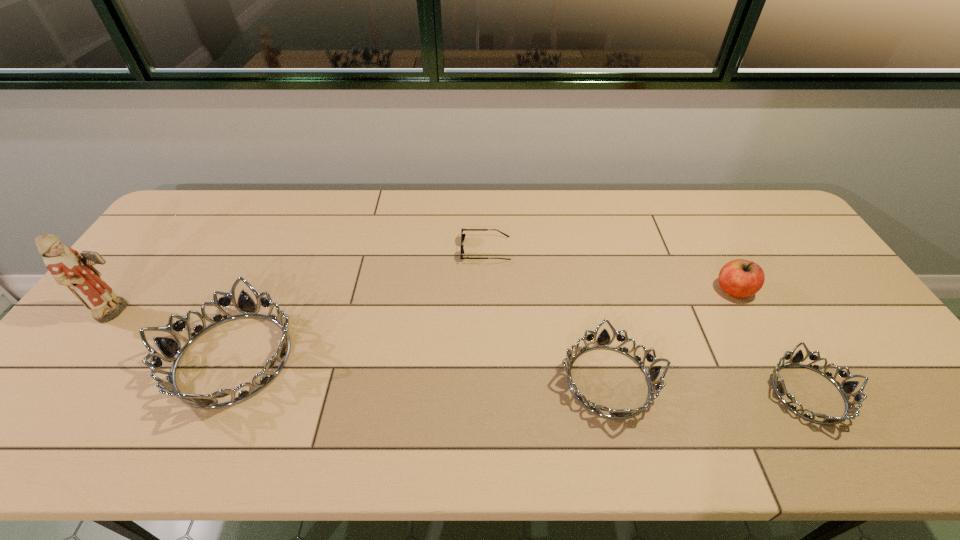
You are a GUI agent. You are given a task and a screenshot of the screen. Output one action in this format:
    pyautogui.click(x=<x>, y=<y>)
    Task: Click on the free point between the apple and the farthest object
    
    Given the screenshot: What is the action you would take?
    pyautogui.click(x=610, y=270)

The image size is (960, 540). What are the coordinates of `unoccupied area between the second tiara from left to right and the apple` in the screenshot? It's located at [671, 335].

The image size is (960, 540). Identify the location of empty space that is in between the shortest tiara and the figurine. (464, 352).

Where is `free spot between the second tiara from right to left and the apple`? The height and width of the screenshot is (540, 960). free spot between the second tiara from right to left and the apple is located at coordinates (671, 335).

Identify the location of free spot between the second shortest object and the fifth object from right to left. This screenshot has height=540, width=960. (521, 376).

Image resolution: width=960 pixels, height=540 pixels. I want to click on free spot between the apple and the second tiara from left to right, so click(671, 335).

The height and width of the screenshot is (540, 960). What are the coordinates of `free space between the leftmost tiara and the shortest tiara` in the screenshot? It's located at (521, 376).

Locate an element on the screen. free spot between the fifth tallest object and the apple is located at coordinates (772, 341).

Locate an element on the screen. unoccupied area between the fourth tallest object and the second shortest object is located at coordinates (708, 387).

The image size is (960, 540). What are the coordinates of `free space between the fourth tallest object and the fifth object from right to left` in the screenshot? It's located at (421, 370).